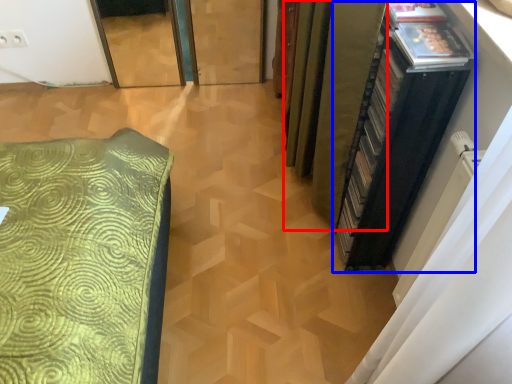
Question: Which object appears farthest to the camera in this image, curtain (highlighted by a red box) or file cabinet (highlighted by a blue box)?

Choices:
 (A) curtain
 (B) file cabinet

Answer: (A)